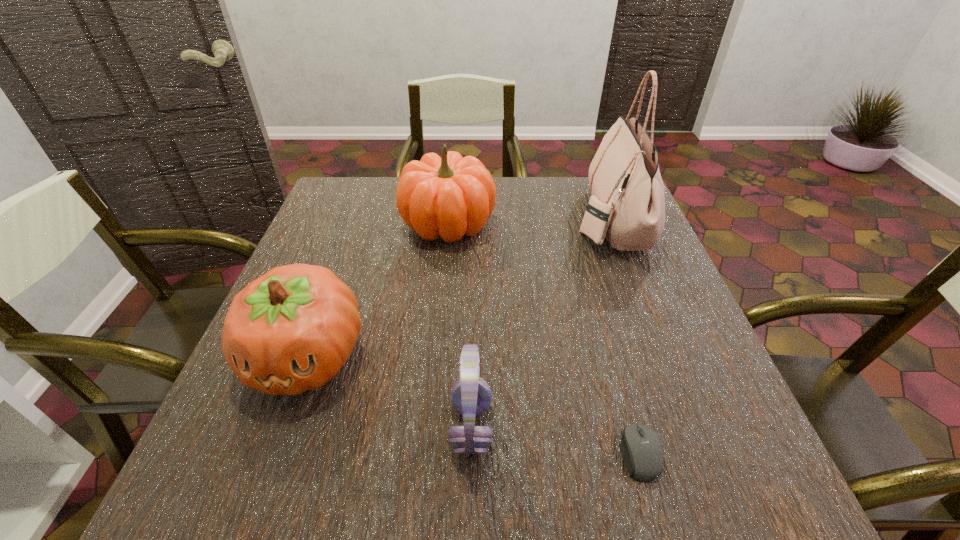
Image resolution: width=960 pixels, height=540 pixels. Identify the location of free space located 0.130m on the side of the nearer pumpkin with the cute face. (260, 487).

You are a GUI agent. You are given a task and a screenshot of the screen. Output one action in this format:
    pyautogui.click(x=<x>, y=<y>)
    Task: Click on the free space located on the headband and ear cups of the headset
    Image resolution: width=960 pixels, height=540 pixels.
    Given the screenshot: What is the action you would take?
    pyautogui.click(x=581, y=427)

Locate an element on the screen. This screenshot has height=540, width=960. vacant area located 0.210m on the left of the computer equipment is located at coordinates (490, 453).

The width and height of the screenshot is (960, 540). What are the coordinates of `handbag situated at the far edge` in the screenshot? It's located at (627, 205).

At what (x,y) coordinates should I click in order to perform the action: click on pumpkin that is positioned at the far edge. Please return your answer as a coordinate pair (x, y). Image resolution: width=960 pixels, height=540 pixels. Looking at the image, I should click on (449, 196).

Find the location of `headset that is at the near edge`. headset that is at the near edge is located at coordinates (471, 396).

The image size is (960, 540). In order to click on computer equipment that is at the near edge in this screenshot , I will do `click(642, 452)`.

Where is `object that is at the left edge`? This screenshot has height=540, width=960. object that is at the left edge is located at coordinates (291, 330).

The height and width of the screenshot is (540, 960). I want to click on handbag at the right edge, so click(x=627, y=205).

The width and height of the screenshot is (960, 540). Identify the location of computer equipment that is at the right edge. (642, 452).